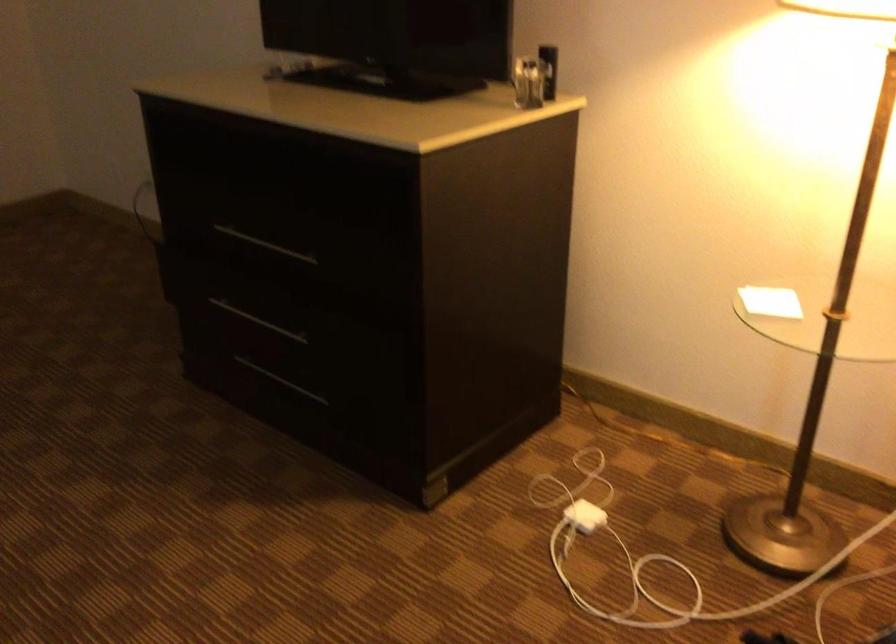
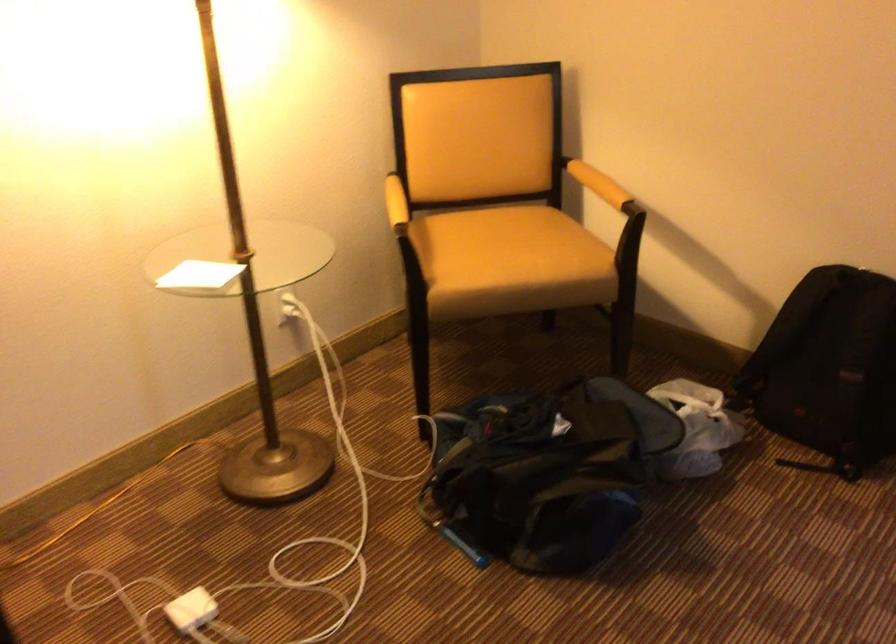
In the second image, find the point that corresponds to pixel 581 516 in the first image.

(192, 609)